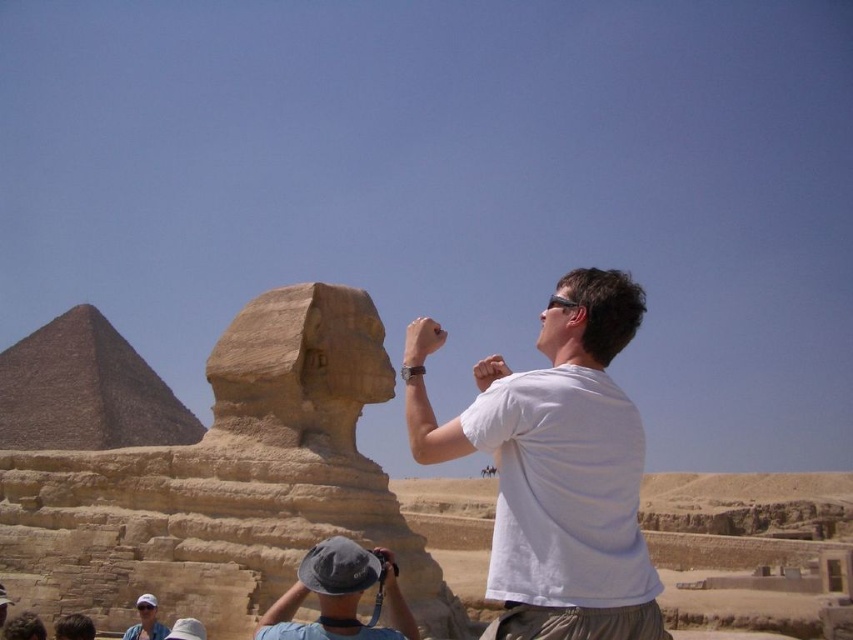
Question: Among these objects, which one is nearest to the camera?

Choices:
 (A) gray fabric hat at center
 (B) white cotton t-shirt at center
 (C) beige stone pyramid at left
 (D) white cotton cap at lower left

Answer: (B)

Question: Is beige stone pyramid at left behind gray fabric hat at center?

Choices:
 (A) no
 (B) yes

Answer: (B)

Question: Is white cotton t-shirt at center closer to the viewer compared to gray fabric hat at center?

Choices:
 (A) yes
 (B) no

Answer: (A)

Question: Among these points, which one is farthest from the camera?

Choices:
 (A) (146, 602)
 (B) (144, 406)

Answer: (B)

Question: Which point appears farthest from the camera in this image?

Choices:
 (A) (564, 604)
 (B) (213, 564)

Answer: (B)

Question: Can you confirm if beige stone sphinx at center is wider than beige stone pyramid at left?

Choices:
 (A) no
 (B) yes

Answer: (B)